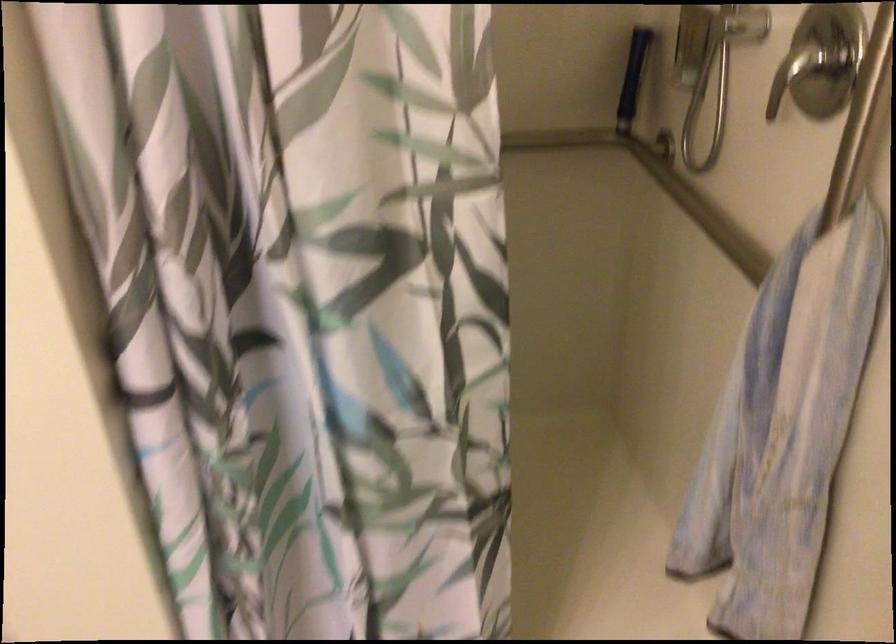
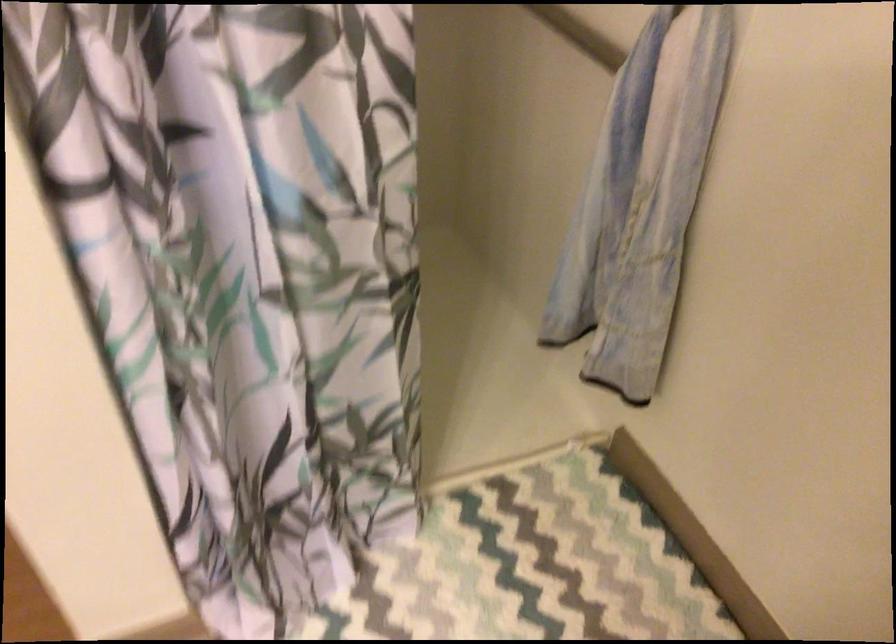
Question: What movement of the cameraman would produce the second image?

Choices:
 (A) Left
 (B) Right
 (C) Forward
 (D) Backward

Answer: (A)